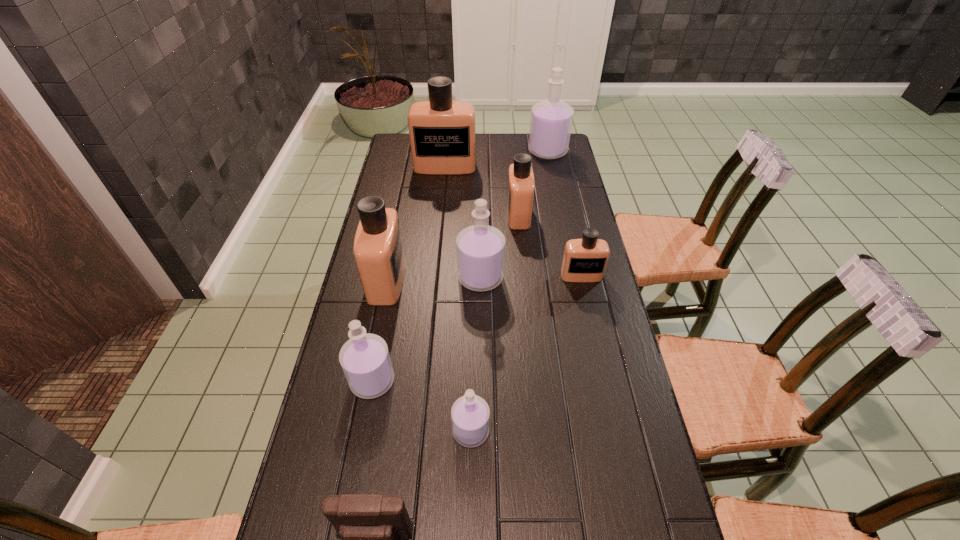
At what (x,y) coordinates should I click in order to perform the action: click on the nearest purple perfume. Please return your answer as a coordinate pair (x, y). The width and height of the screenshot is (960, 540). Looking at the image, I should click on (470, 414).

This screenshot has height=540, width=960. In order to click on the rightmost beige perfume in this screenshot , I will do `click(585, 260)`.

The width and height of the screenshot is (960, 540). Identify the location of blank space located 0.210m on the left of the farthest purple perfume. (481, 151).

Where is `vacant area situated on the front label of the biggest beige perfume`? The width and height of the screenshot is (960, 540). vacant area situated on the front label of the biggest beige perfume is located at coordinates (442, 200).

Identify the location of free space located 0.240m on the front label of the second biggest beige perfume. This screenshot has height=540, width=960. (479, 280).

At what (x,y) coordinates should I click in order to perform the action: click on vacant region located on the left of the second farthest purple perfume. Please return your answer as a coordinate pair (x, y). The image size is (960, 540). Looking at the image, I should click on click(386, 278).

Identify the location of vacant area located on the front label of the second farthest beige perfume. The image size is (960, 540). (467, 215).

I want to click on blank space located 0.310m on the front label of the second farthest beige perfume, so click(423, 215).

Find the location of `vacant space situated 0.270m on the front label of the second farthest beige perfume`. vacant space situated 0.270m on the front label of the second farthest beige perfume is located at coordinates tap(434, 215).

What are the coordinates of `vacant region located on the front of the third biggest purple perfume` in the screenshot? It's located at (360, 444).